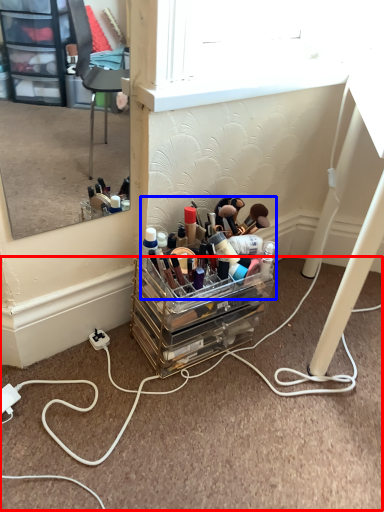
Question: Which object appears closest to the camera in this image, cable (highlighted by a red box) or toiletry (highlighted by a blue box)?

Choices:
 (A) cable
 (B) toiletry

Answer: (A)